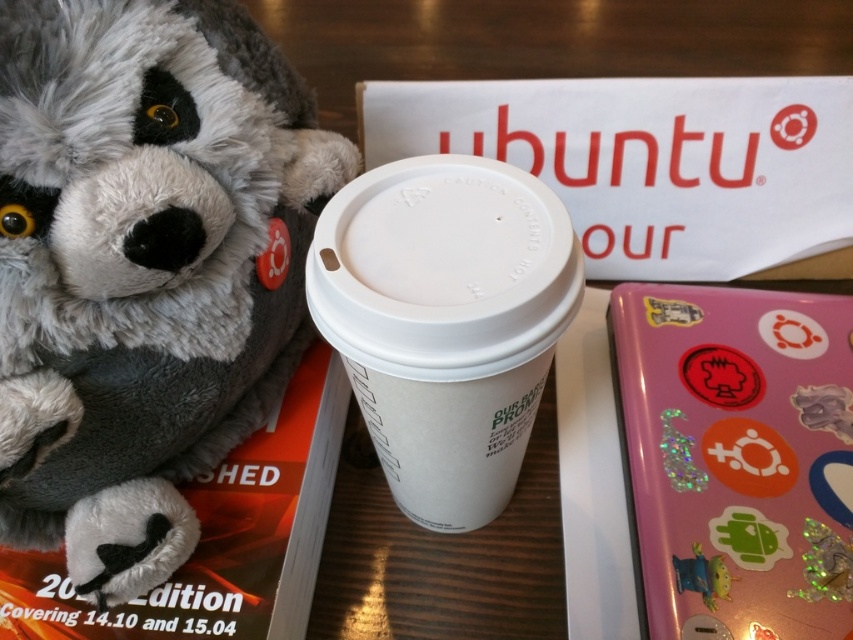
Between point (79, 292) and point (723, 596), which one is positioned behind?

The point (723, 596) is behind.

Is point (9, 136) more distant than point (711, 589)?

No.

The image size is (853, 640). Identify the location of fluffy gray teddy bear at left. [144, 268].

Is fluffy gray teddy bear at left positioned before glittery plastic toy at lower right?

That is True.

Between fluffy gray teddy bear at left and glittery plastic toy at lower right, which one is positioned lower?

glittery plastic toy at lower right

Who is more distant from viewer, (15,236) or (846,577)?

The point (846,577) is more distant.

Locate an element on the screen. This screenshot has height=640, width=853. fluffy gray teddy bear at left is located at coordinates (144, 268).

Is white paper cup at center above glittery plastic toy at lower right?

Yes, white paper cup at center is above glittery plastic toy at lower right.

Consider the image. Which is more to the left, white paper cup at center or glittery plastic toy at lower right?

Positioned to the left is white paper cup at center.

Is point (416, 266) farther from camera compared to point (820, 534)?

No.

Where is `white paper cup at center`? white paper cup at center is located at coordinates (445, 321).